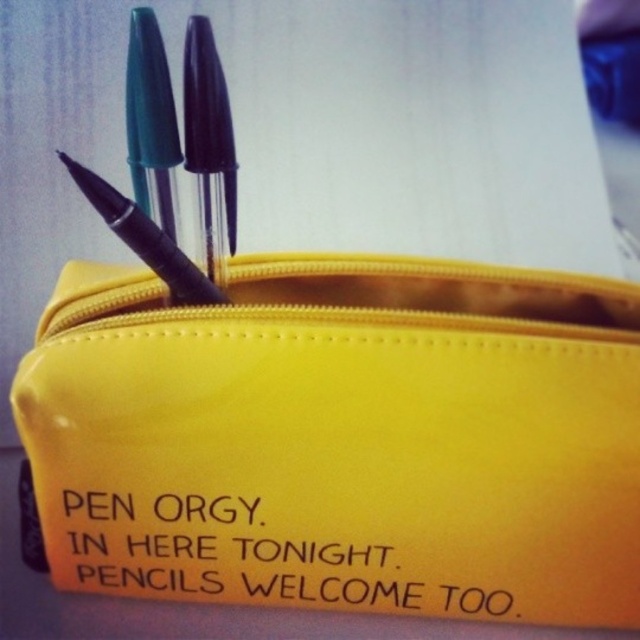
Question: Which point appears farthest from the camera in this image?

Choices:
 (A) (410, 513)
 (B) (611, 550)
 (C) (212, 296)

Answer: (C)

Question: Is yellow vinyl pouch at center wider than matte black pencil at upper center?

Choices:
 (A) yes
 (B) no

Answer: (A)

Question: Which object is positioned farthest from the yellow matte text at center?

Choices:
 (A) yellow vinyl pouch at center
 (B) matte black pencil at upper center

Answer: (B)

Question: Is yellow matte text at center above matte black pencil at upper center?

Choices:
 (A) yes
 (B) no

Answer: (B)

Question: Is yellow matte text at center positioned behind matte black pencil at upper center?

Choices:
 (A) no
 (B) yes

Answer: (B)

Question: Considering the real-world distances, which object is farthest from the yellow vinyl pouch at center?

Choices:
 (A) matte black pencil at upper center
 (B) yellow matte text at center

Answer: (A)